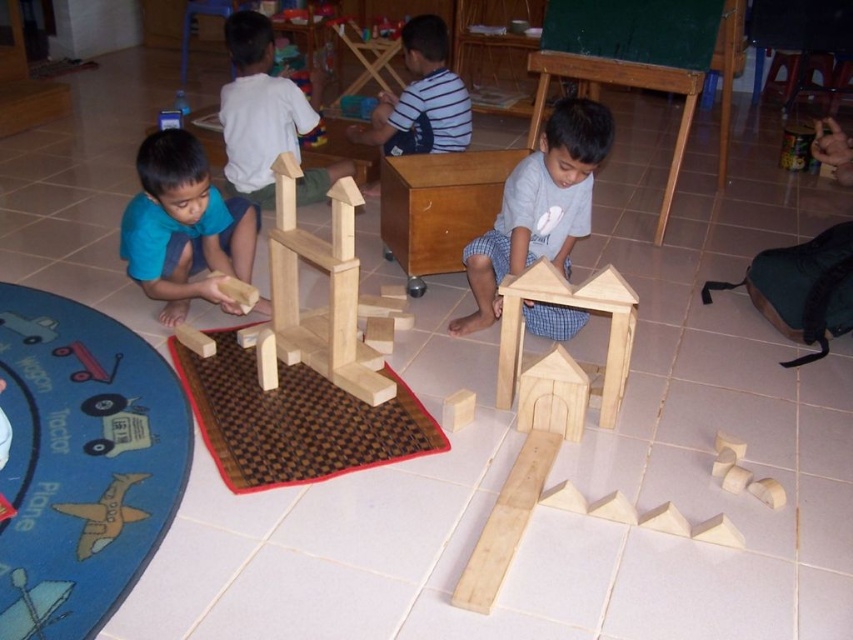
Who is positioned more to the right, blue fabric mat at lower left or wooden toy car at lower left?

Positioned to the right is blue fabric mat at lower left.

Who is positioned more to the left, blue fabric mat at lower left or wooden toy car at lower left?

wooden toy car at lower left

You are a GUI agent. You are given a task and a screenshot of the screen. Output one action in this format:
    pyautogui.click(x=<x>, y=<y>)
    Task: Click on the blue fabric mat at lower left
    
    Given the screenshot: What is the action you would take?
    pyautogui.click(x=83, y=468)

Image resolution: width=853 pixels, height=640 pixels. Identify the location of blue fabric mat at lower left. (83, 468).

Consider the image. Who is taller, wooden house at lower center or striped shirt at center?

With more height is striped shirt at center.

Between wooden house at lower center and striped shirt at center, which one is positioned higher?

Positioned higher is striped shirt at center.

The width and height of the screenshot is (853, 640). What do you see at coordinates (573, 307) in the screenshot?
I see `wooden house at lower center` at bounding box center [573, 307].

The width and height of the screenshot is (853, 640). In order to click on wooden house at lower center in this screenshot , I will do `click(573, 307)`.

Is point (177, 212) farther from viewer compared to point (16, 330)?

No, (177, 212) is closer to viewer.

Between blue matte shirt at lower left and wooden tractor at lower left, which one is positioned lower?

wooden tractor at lower left is below.

Which is behind, point (149, 285) or point (54, 324)?

Positioned behind is point (54, 324).

Where is `blue matte shirt at lower left`? blue matte shirt at lower left is located at coordinates (183, 227).